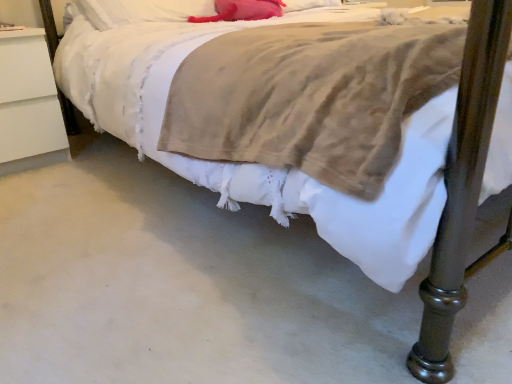
Question: From the image's perspective, is white matte nightstand at left located above white soft pillow at upper center, which is counted as the 2th pillow, starting from the right?

Choices:
 (A) yes
 (B) no

Answer: (B)

Question: Is white matte nightstand at left positioned with its back to white soft pillow at upper center, acting as the 1th pillow starting from the left?

Choices:
 (A) no
 (B) yes

Answer: (A)

Question: Is white matte nightstand at left further to camera compared to white soft pillow at upper center, acting as the 1th pillow starting from the left?

Choices:
 (A) yes
 (B) no

Answer: (B)

Question: Can white soft pillow at upper center, acting as the 1th pillow starting from the left, be found inside white matte nightstand at left?

Choices:
 (A) yes
 (B) no

Answer: (B)

Question: Is white matte nightstand at left shorter than white soft pillow at upper center, acting as the 1th pillow starting from the left?

Choices:
 (A) yes
 (B) no

Answer: (B)

Question: In terms of width, does matte pink pillow at upper center, the 1th pillow positioned from the right, look wider or thinner when compared to white matte nightstand at left?

Choices:
 (A) wide
 (B) thin

Answer: (B)

Question: Is point (273, 3) positioned closer to the camera than point (2, 89)?

Choices:
 (A) closer
 (B) farther

Answer: (A)

Question: From a real-world perspective, is matte pink pillow at upper center, the 2th pillow positioned from the left, physically located above or below white matte nightstand at left?

Choices:
 (A) above
 (B) below

Answer: (A)

Question: From the image's perspective, is matte pink pillow at upper center, the 2th pillow positioned from the left, located above or below white matte nightstand at left?

Choices:
 (A) below
 (B) above

Answer: (B)

Question: Considering their positions, is matte pink pillow at upper center, the 2th pillow positioned from the left, located in front of or behind white soft pillow at upper center, which is counted as the 2th pillow, starting from the right?

Choices:
 (A) front
 (B) behind

Answer: (B)

Question: Looking at their shapes, would you say matte pink pillow at upper center, the 2th pillow positioned from the left, is wider or thinner than white soft pillow at upper center, acting as the 1th pillow starting from the left?

Choices:
 (A) thin
 (B) wide

Answer: (B)

Question: From a real-world perspective, relative to white soft pillow at upper center, which is counted as the 2th pillow, starting from the right, is matte pink pillow at upper center, the 2th pillow positioned from the left, vertically above or below?

Choices:
 (A) above
 (B) below

Answer: (B)

Question: Considering the positions of matte pink pillow at upper center, the 1th pillow positioned from the right, and white soft pillow at upper center, acting as the 1th pillow starting from the left, in the image, is matte pink pillow at upper center, the 1th pillow positioned from the right, taller or shorter than white soft pillow at upper center, acting as the 1th pillow starting from the left,?

Choices:
 (A) tall
 (B) short

Answer: (B)

Question: In the image, is white soft pillow at upper center, acting as the 1th pillow starting from the left, on the left side or the right side of matte pink pillow at upper center, the 1th pillow positioned from the right?

Choices:
 (A) right
 (B) left

Answer: (B)

Question: In terms of width, does white soft pillow at upper center, acting as the 1th pillow starting from the left, look wider or thinner when compared to matte pink pillow at upper center, the 1th pillow positioned from the right?

Choices:
 (A) wide
 (B) thin

Answer: (B)